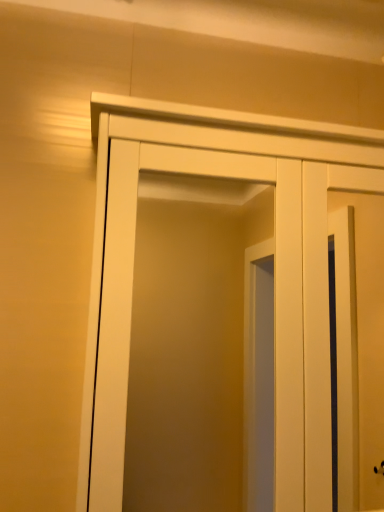
Where is `white matte cabinet at center`? This screenshot has width=384, height=512. white matte cabinet at center is located at coordinates (191, 151).

What is the approximate width of white matte cabinet at center?

white matte cabinet at center is 19.57 centimeters in width.

Describe the element at coordinates (191, 151) in the screenshot. The height and width of the screenshot is (512, 384). I see `white matte cabinet at center` at that location.

Where is `white matte cabinet at center`? Image resolution: width=384 pixels, height=512 pixels. white matte cabinet at center is located at coordinates (191, 151).